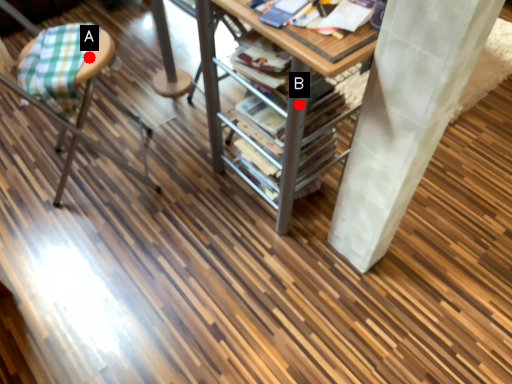
Question: Two points are circled on the image, labeled by A and B beside each circle. Which point is closer to the camera?

Choices:
 (A) A is closer
 (B) B is closer

Answer: (B)